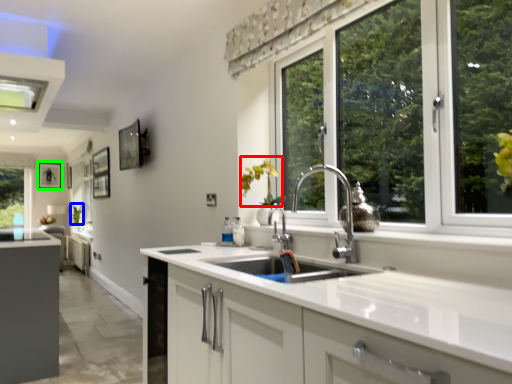
Question: Which object is the closest to the flower (highlighted by a red box)? Choose among these: plant (highlighted by a blue box) or picture frame (highlighted by a green box).

Choices:
 (A) plant
 (B) picture frame

Answer: (A)